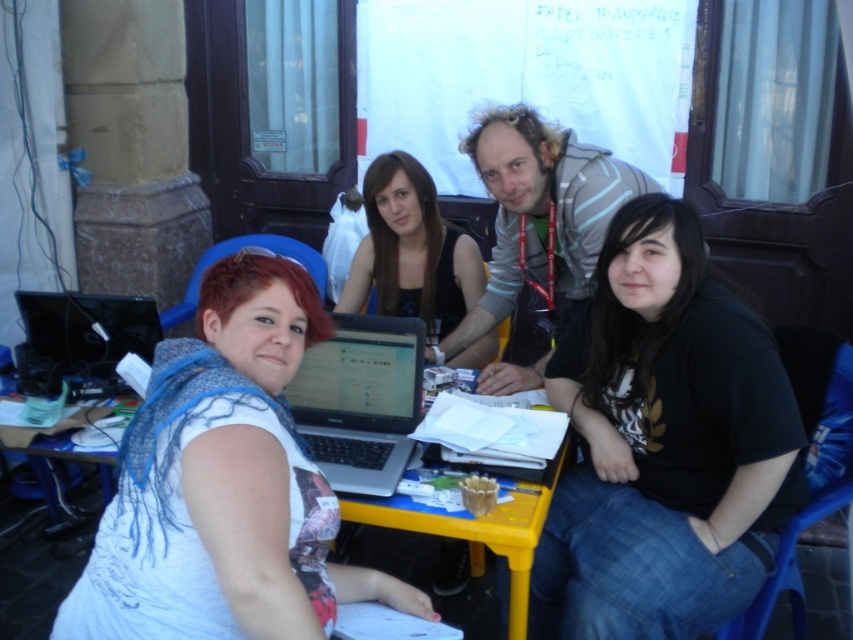
You are standing in front of a yellow plastic table at lower center that is 7.41 feet away from you. You want to place a 2.5 feet wide book on it. Will the book fit on the table?

The yellow plastic table at lower center is 7.41 feet from the viewer, but the distance does not indicate the table size. The question cannot be answered with the given information.

You are standing at the point with coordinates point (x=28, y=620) and want to walk to the point with coordinates point (x=395, y=458). Which direction should you move to get closer to your destination?

To move from point (x=28, y=620) to point (x=395, y=458), you should move north because point (x=28, y=620) is behind point (x=395, y=458).